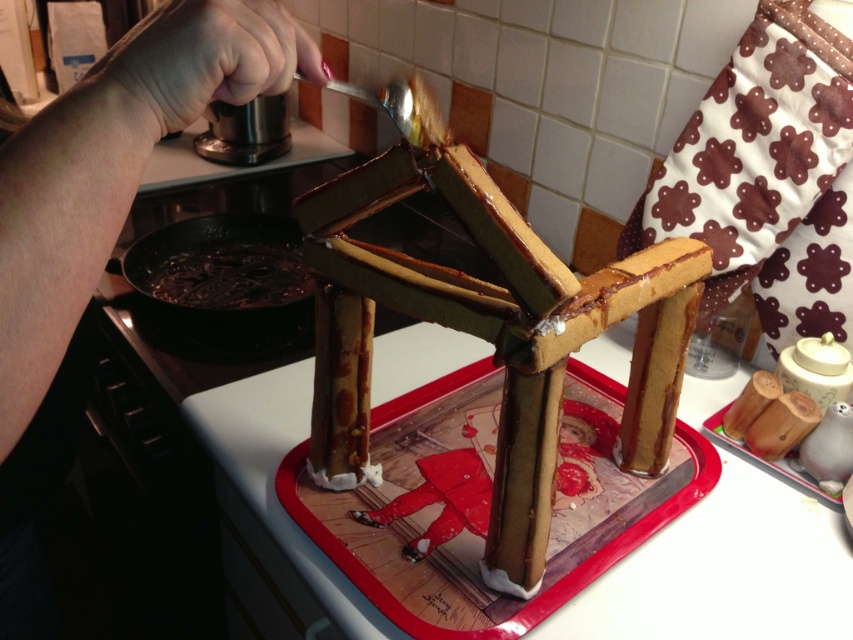
Which is more to the left, smooth chocolate gingerbread house at center or shiny dark chocolate at lower left?

Positioned to the left is shiny dark chocolate at lower left.

The width and height of the screenshot is (853, 640). Identify the location of smooth chocolate gingerbread house at center. (444, 496).